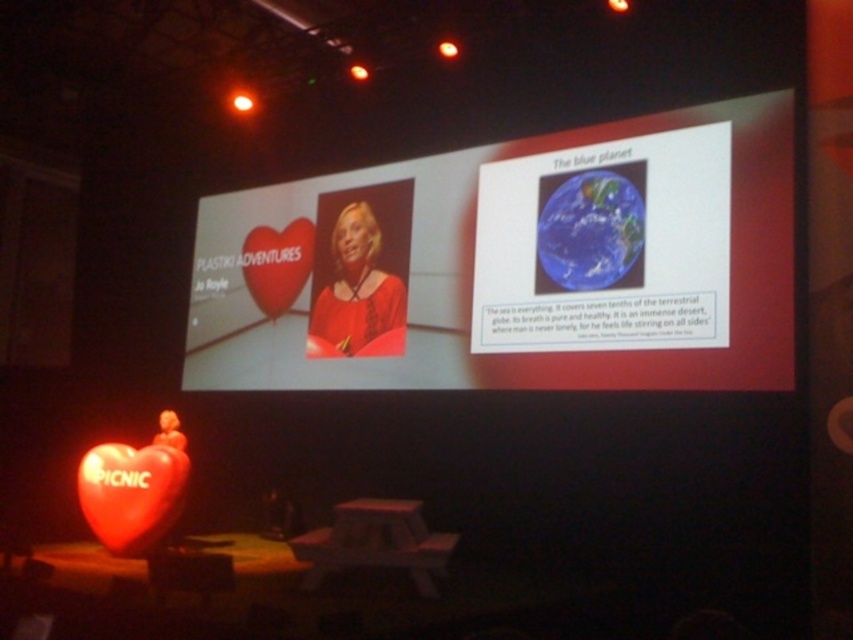
Can you confirm if blue glossy earth at upper right is shorter than matte red heart at center?

Yes.

Can you confirm if blue glossy earth at upper right is taller than matte red heart at center?

No.

Which is behind, point (635, 188) or point (279, 232)?

The point (279, 232) is behind.

At what (x,y) coordinates should I click in order to perform the action: click on blue glossy earth at upper right. Please return your answer as a coordinate pair (x, y). Image resolution: width=853 pixels, height=640 pixels. Looking at the image, I should click on (590, 228).

Who is taller, white glossy projection screen at upper center or matte red heart at center?

white glossy projection screen at upper center

Is white glossy projection screen at upper center closer to camera compared to matte red heart at center?

That is True.

Which is in front, point (476, 262) or point (296, 284)?

Point (476, 262) is in front.

At what (x,y) coordinates should I click in order to perform the action: click on white glossy projection screen at upper center. Please return your answer as a coordinate pair (x, y). This screenshot has height=640, width=853. Looking at the image, I should click on (523, 264).

Between white glossy projection screen at upper center and blue glossy earth at upper right, which one has more height?

Standing taller between the two is white glossy projection screen at upper center.

Does white glossy projection screen at upper center have a greater height compared to blue glossy earth at upper right?

Yes.

Locate an element on the screen. white glossy projection screen at upper center is located at coordinates (523, 264).